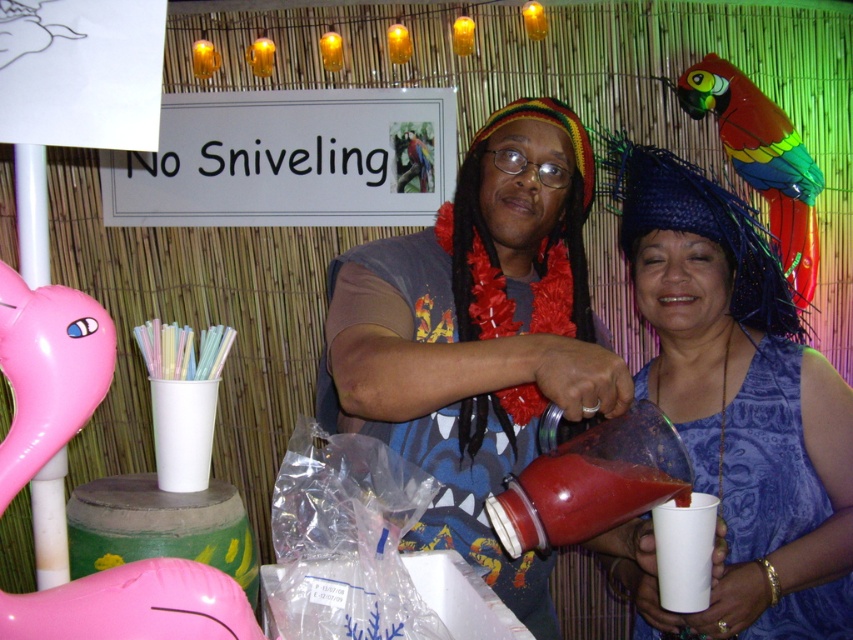
In the scene shown: You are at a party and need to choose a gift for a friend. The gift must be big enough to hold a small toy. You see the blue fabric dress at center and the rainbow feathered parrot at upper right. Which item can the gift box be sized to accommodate?

The blue fabric dress at center has a larger size compared to the rainbow feathered parrot at upper right, so the gift box should be sized to accommodate the blue fabric dress at center.

You are at the party and want to take a photo of both the blue fabric dress at center and the rainbow feathered parrot at upper right. Which one should you focus on first to ensure both are in clear focus?

You should focus on the blue fabric dress at center first because it is closer to the viewer than the rainbow feathered parrot at upper right, ensuring both will be in focus when using depth of field.